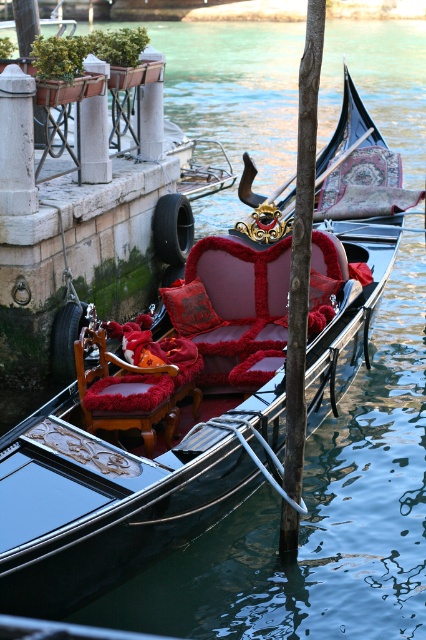
Can you confirm if velvet red daybed at center is positioned to the left of velvet red chair at center?

No, velvet red daybed at center is not to the left of velvet red chair at center.

In order to click on velvet red daybed at center in this screenshot , I will do `click(233, 310)`.

Locate an element on the screen. This screenshot has height=640, width=426. velvet red chair at center is located at coordinates (124, 392).

Is velvet red chair at center wider than silky red cushion at center?

Correct, the width of velvet red chair at center exceeds that of silky red cushion at center.

Is point (85, 403) farther from camera compared to point (207, 321)?

That is False.

The width and height of the screenshot is (426, 640). What are the coordinates of `velvet red chair at center` in the screenshot? It's located at (124, 392).

In the scene shown: Between smooth brown wood pole at center and silky red cushion at center, which one is positioned higher?

smooth brown wood pole at center

Who is lower down, smooth brown wood pole at center or silky red cushion at center?

silky red cushion at center is below.

Is point (301, 420) positioned after point (189, 312)?

No, (301, 420) is in front of (189, 312).

Where is `smooth brown wood pole at center`? smooth brown wood pole at center is located at coordinates (302, 248).